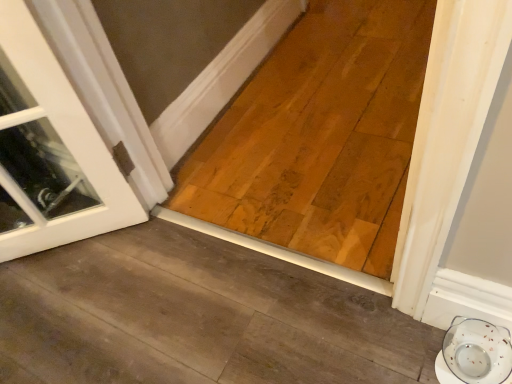
Question: Is natural wood plank at center thinner than white glossy saucer at lower right?

Choices:
 (A) no
 (B) yes

Answer: (A)

Question: Can white glossy saucer at lower right be found inside natural wood plank at center?

Choices:
 (A) yes
 (B) no

Answer: (B)

Question: Considering the relative sizes of natural wood plank at center and white glossy saucer at lower right in the image provided, is natural wood plank at center taller than white glossy saucer at lower right?

Choices:
 (A) yes
 (B) no

Answer: (B)

Question: From the image's perspective, does natural wood plank at center appear higher than white glossy saucer at lower right?

Choices:
 (A) yes
 (B) no

Answer: (A)

Question: From a real-world perspective, is natural wood plank at center on white glossy saucer at lower right?

Choices:
 (A) yes
 (B) no

Answer: (B)

Question: Is natural wood plank at center behind white glossy saucer at lower right?

Choices:
 (A) no
 (B) yes

Answer: (B)

Question: Does white glossy saucer at lower right appear on the left side of natural wood plank at center?

Choices:
 (A) yes
 (B) no

Answer: (B)

Question: Can you confirm if white glossy saucer at lower right is shorter than natural wood plank at center?

Choices:
 (A) no
 (B) yes

Answer: (A)

Question: Are white glossy saucer at lower right and natural wood plank at center making contact?

Choices:
 (A) yes
 (B) no

Answer: (B)

Question: Considering the relative sizes of white glossy saucer at lower right and natural wood plank at center in the image provided, is white glossy saucer at lower right bigger than natural wood plank at center?

Choices:
 (A) yes
 (B) no

Answer: (B)

Question: Considering the relative sizes of white glossy saucer at lower right and natural wood plank at center in the image provided, is white glossy saucer at lower right thinner than natural wood plank at center?

Choices:
 (A) no
 (B) yes

Answer: (B)

Question: Is white glossy saucer at lower right outside natural wood plank at center?

Choices:
 (A) yes
 (B) no

Answer: (A)

Question: From the image's perspective, is natural wood plank at center positioned above or below white glossy saucer at lower right?

Choices:
 (A) below
 (B) above

Answer: (B)